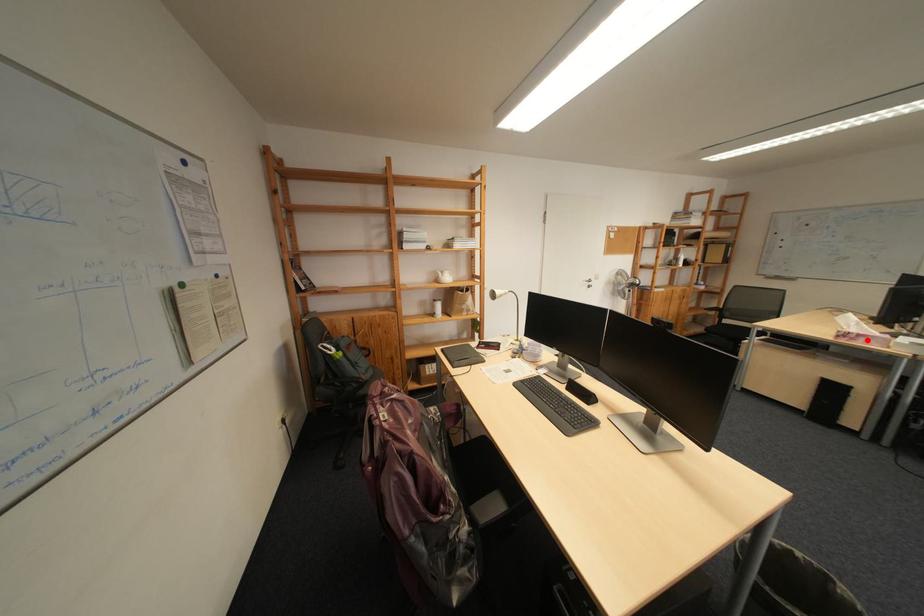
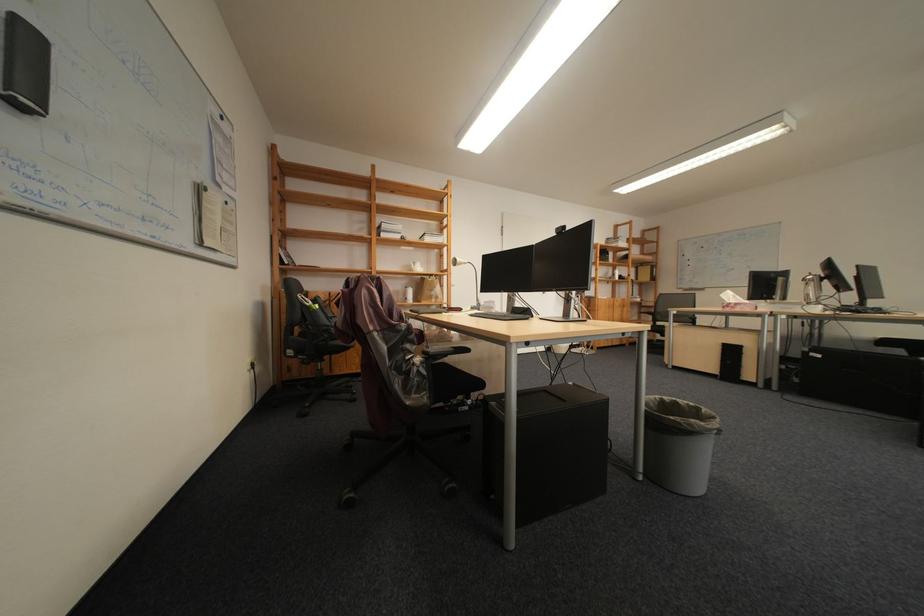
Locate, in the second image, the point that corresponds to the highlighted location in the first image.

(747, 309)